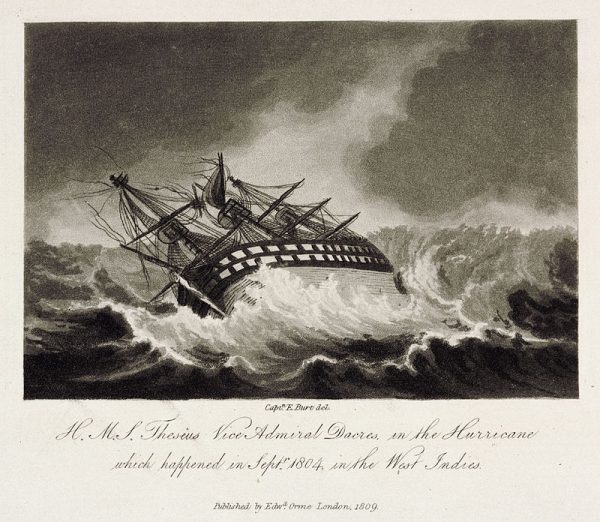
This screenshot has width=600, height=522. Find the location of `upper left corner of artwork`. upper left corner of artwork is located at coordinates (24, 22).